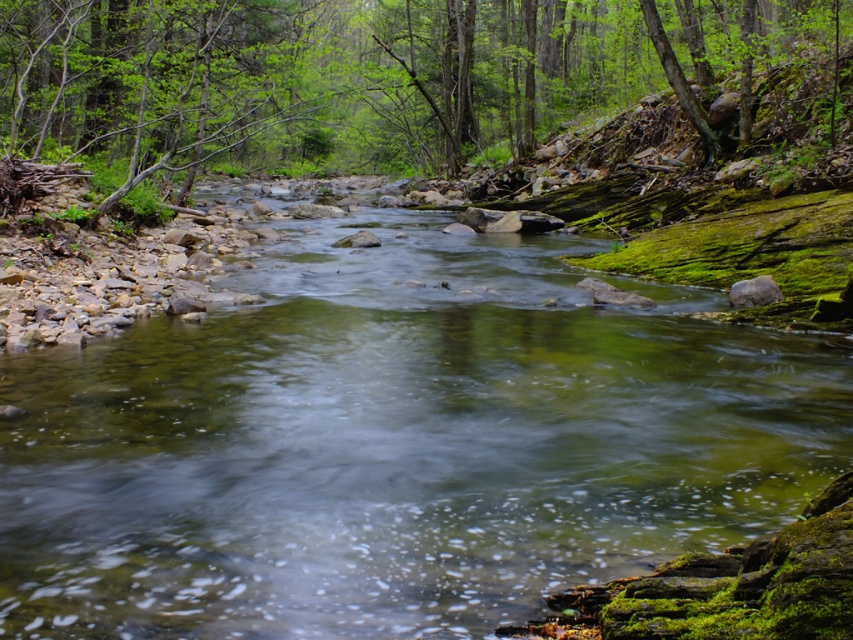
Question: Can you confirm if clear water at center is thinner than green leafy tree at upper center?

Choices:
 (A) no
 (B) yes

Answer: (B)

Question: Can you confirm if clear water at center is positioned below green leafy tree at upper center?

Choices:
 (A) no
 (B) yes

Answer: (B)

Question: Among these objects, which one is nearest to the camera?

Choices:
 (A) clear water at center
 (B) green leafy tree at upper center

Answer: (A)

Question: In this image, where is clear water at center located relative to green leafy tree at upper center?

Choices:
 (A) above
 (B) below

Answer: (B)